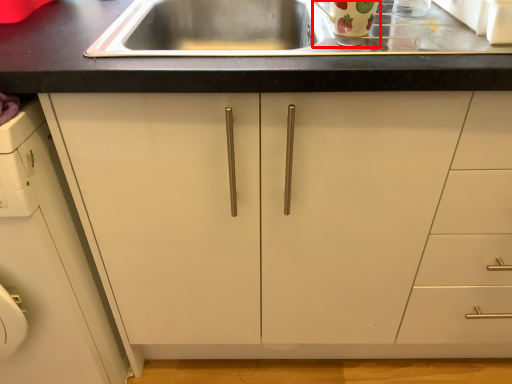
Question: In this image, where is appliance (annotated by the red box) located relative to cabinetry?

Choices:
 (A) right
 (B) left

Answer: (A)